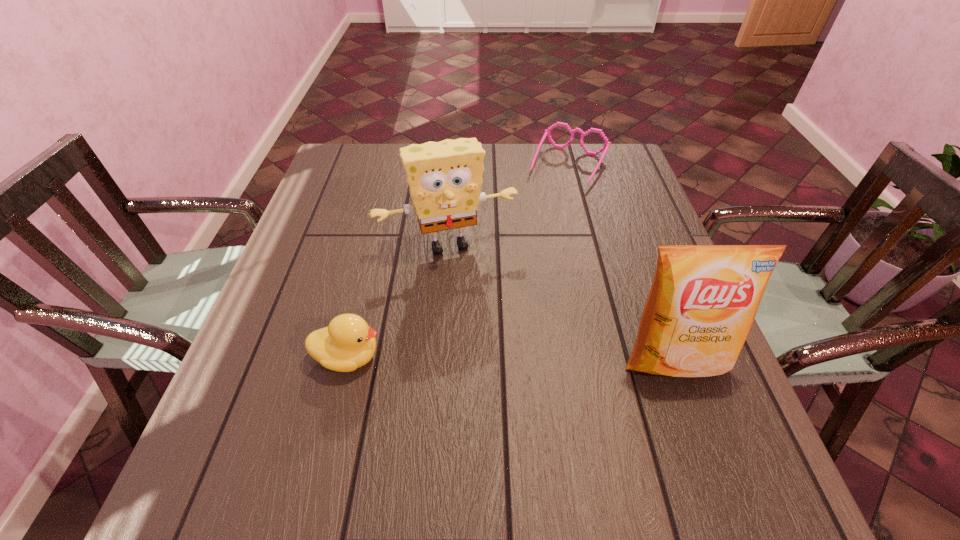
You are a GUI agent. You are given a task and a screenshot of the screen. Output one action in this format:
    pyautogui.click(x=<x>, y=<y>)
    Task: Click on the empty location between the crisp (potato chip) and the duckling
    Image resolution: width=960 pixels, height=540 pixels.
    Given the screenshot: What is the action you would take?
    pyautogui.click(x=511, y=359)

Where is `free space between the third nearest object and the second shortest object`? free space between the third nearest object and the second shortest object is located at coordinates (398, 300).

At what (x,y) coordinates should I click in order to perform the action: click on object that is the closest to the second shortest object. Please return your answer as a coordinate pair (x, y). Looking at the image, I should click on (445, 177).

Select which object is the third closest to the third tallest object. Please provide its 2D coordinates. Your answer should be formatted as a tuple, i.e. [(x, y)], where the tuple contains the x and y coordinates of a point satisfying the conditions above.

[(547, 132)]

You are a GUI agent. You are given a task and a screenshot of the screen. Output one action in this format:
    pyautogui.click(x=<x>, y=<y>)
    Task: Click on the vacant space that satisfies the following two spatial constraints: 1. on the back side of the farthest object; 2. on the left side of the sponge
    
    Given the screenshot: What is the action you would take?
    pyautogui.click(x=454, y=166)